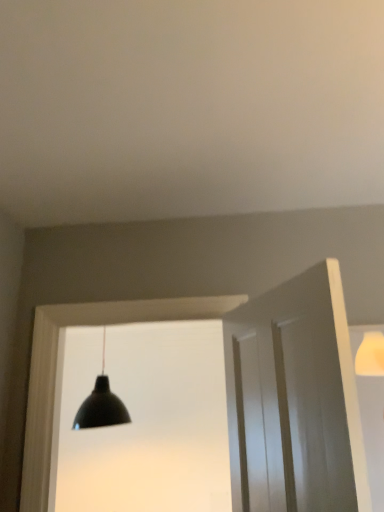
Question: Is white wood door frame at center further to the viewer compared to white smooth door at right?

Choices:
 (A) yes
 (B) no

Answer: (A)

Question: Is white wood door frame at center positioned with its back to white smooth door at right?

Choices:
 (A) yes
 (B) no

Answer: (B)

Question: Is white wood door frame at center completely or partially outside of white smooth door at right?

Choices:
 (A) yes
 (B) no

Answer: (A)

Question: Considering the relative sizes of white wood door frame at center and white smooth door at right in the image provided, is white wood door frame at center thinner than white smooth door at right?

Choices:
 (A) no
 (B) yes

Answer: (A)

Question: Is white smooth door at right inside white wood door frame at center?

Choices:
 (A) yes
 (B) no

Answer: (B)

Question: Is black matte lamp at center to the left or to the right of white smooth door at right in the image?

Choices:
 (A) right
 (B) left

Answer: (B)

Question: In terms of width, does black matte lamp at center look wider or thinner when compared to white smooth door at right?

Choices:
 (A) thin
 (B) wide

Answer: (B)

Question: Would you say black matte lamp at center is inside or outside white smooth door at right?

Choices:
 (A) outside
 (B) inside

Answer: (A)

Question: From their relative heights in the image, would you say black matte lamp at center is taller or shorter than white smooth door at right?

Choices:
 (A) short
 (B) tall

Answer: (B)

Question: Considering the positions of white wood door frame at center and white smooth door at right in the image, is white wood door frame at center wider or thinner than white smooth door at right?

Choices:
 (A) thin
 (B) wide

Answer: (B)

Question: From a real-world perspective, is white wood door frame at center physically located above or below white smooth door at right?

Choices:
 (A) above
 (B) below

Answer: (A)

Question: Looking at the image, does white wood door frame at center seem bigger or smaller compared to white smooth door at right?

Choices:
 (A) big
 (B) small

Answer: (A)

Question: Is white wood door frame at center taller or shorter than white smooth door at right?

Choices:
 (A) short
 (B) tall

Answer: (B)

Question: Relative to white wood door frame at center, is white smooth door at right in front or behind?

Choices:
 (A) front
 (B) behind

Answer: (A)

Question: Looking at the image, does white smooth door at right seem bigger or smaller compared to white wood door frame at center?

Choices:
 (A) big
 (B) small

Answer: (B)